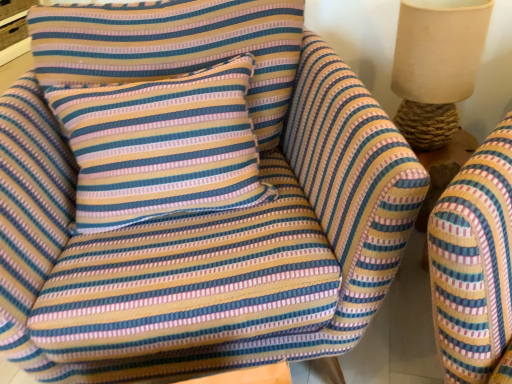
Question: Is burlap lampshade at upper right to the left of striped fabric pillow at center from the viewer's perspective?

Choices:
 (A) yes
 (B) no

Answer: (B)

Question: Would you say striped fabric pillow at center is part of burlap lampshade at upper right's contents?

Choices:
 (A) yes
 (B) no

Answer: (B)

Question: Does burlap lampshade at upper right have a larger size compared to striped fabric pillow at center?

Choices:
 (A) no
 (B) yes

Answer: (A)

Question: Is burlap lampshade at upper right aimed at striped fabric pillow at center?

Choices:
 (A) no
 (B) yes

Answer: (A)

Question: Is burlap lampshade at upper right turned away from striped fabric pillow at center?

Choices:
 (A) yes
 (B) no

Answer: (B)

Question: Does burlap lampshade at upper right have a greater height compared to striped fabric pillow at center?

Choices:
 (A) yes
 (B) no

Answer: (B)

Question: Is striped fabric pillow at center not near burlap lampshade at upper right?

Choices:
 (A) no
 (B) yes

Answer: (A)

Question: From a real-world perspective, is striped fabric pillow at center under burlap lampshade at upper right?

Choices:
 (A) no
 (B) yes

Answer: (B)

Question: From a real-world perspective, is striped fabric pillow at center located higher than burlap lampshade at upper right?

Choices:
 (A) no
 (B) yes

Answer: (A)

Question: Does striped fabric pillow at center have a smaller size compared to burlap lampshade at upper right?

Choices:
 (A) yes
 (B) no

Answer: (B)

Question: Is striped fabric pillow at center positioned behind burlap lampshade at upper right?

Choices:
 (A) no
 (B) yes

Answer: (A)

Question: Is striped fabric pillow at center shorter than burlap lampshade at upper right?

Choices:
 (A) yes
 (B) no

Answer: (B)

Question: Based on their positions, is striped fabric pillow at center located to the left or right of burlap lampshade at upper right?

Choices:
 (A) left
 (B) right

Answer: (A)